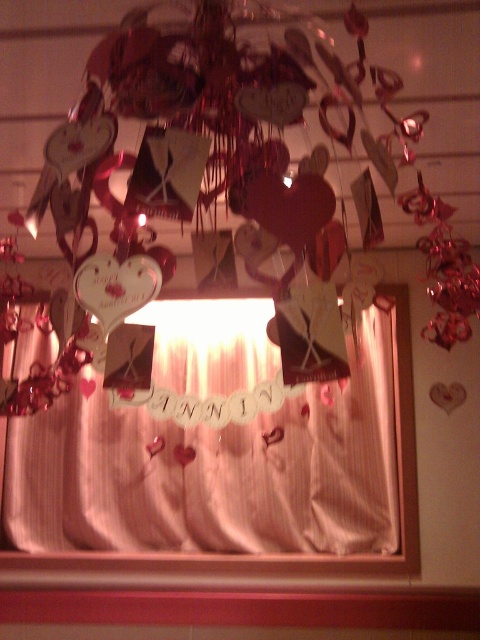
You are planning to hang a new decoration between the matte red heart at center and the silky white curtain at center. Based on their heights, which object should the new decoration be placed closer to?

The new decoration should be placed closer to the silky white curtain at center because the matte red heart at center is shorter than the silky white curtain at center, meaning the curtain is taller and the decoration can be aligned accordingly.

You are standing in front of the window and want to touch the silky white curtain at center. Is the matte red heart at center blocking your path?

The matte red heart at center is closer to the viewer than the silky white curtain at center, so it would block your path to the curtain.